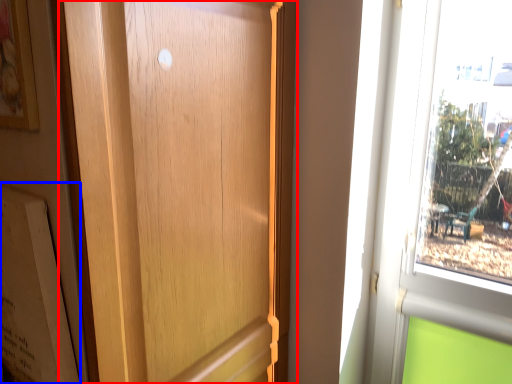
Question: Which object is closer to the camera taking this photo, door (highlighted by a red box) or bulletin board (highlighted by a blue box)?

Choices:
 (A) door
 (B) bulletin board

Answer: (A)